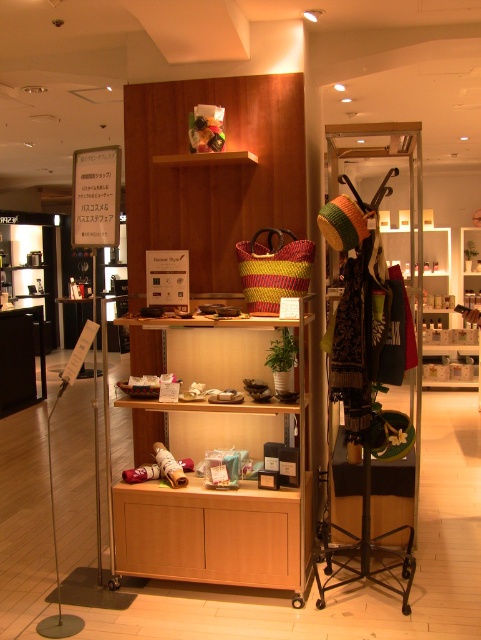
Question: Can you confirm if wooden shelf at center is smaller than yellow-green woven basket at center?

Choices:
 (A) yes
 (B) no

Answer: (B)

Question: Does wooden shelf at center appear over yellow-green woven basket at center?

Choices:
 (A) no
 (B) yes

Answer: (A)

Question: Is the position of wooden shelf at center less distant than that of yellow-green woven basket at center?

Choices:
 (A) yes
 (B) no

Answer: (A)

Question: Among these points, which one is nearest to the camera?

Choices:
 (A) (269, 305)
 (B) (269, 556)

Answer: (B)

Question: Which object is farther from the camera taking this photo?

Choices:
 (A) wooden shelf at center
 (B) yellow-green woven basket at center

Answer: (B)